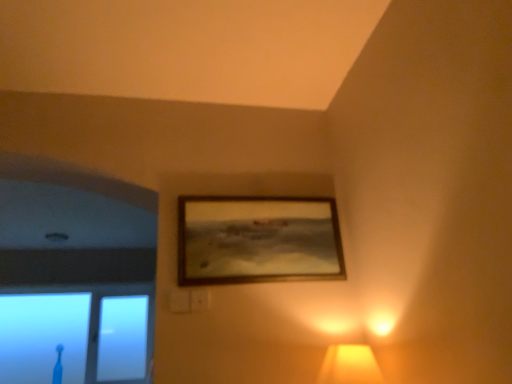
Question: In terms of size, does matte yellow lampshade at lower right appear bigger or smaller than wooden frame at upper center?

Choices:
 (A) small
 (B) big

Answer: (A)

Question: Is matte yellow lampshade at lower right inside the boundaries of wooden frame at upper center, or outside?

Choices:
 (A) outside
 (B) inside

Answer: (A)

Question: Which object is positioned farthest from the matte yellow lampshade at lower right?

Choices:
 (A) wooden frame at upper center
 (B) transparent glass toothbrush at lower left

Answer: (B)

Question: Based on their relative distances, which object is farther from the wooden frame at upper center?

Choices:
 (A) matte yellow lampshade at lower right
 (B) transparent glass toothbrush at lower left

Answer: (B)